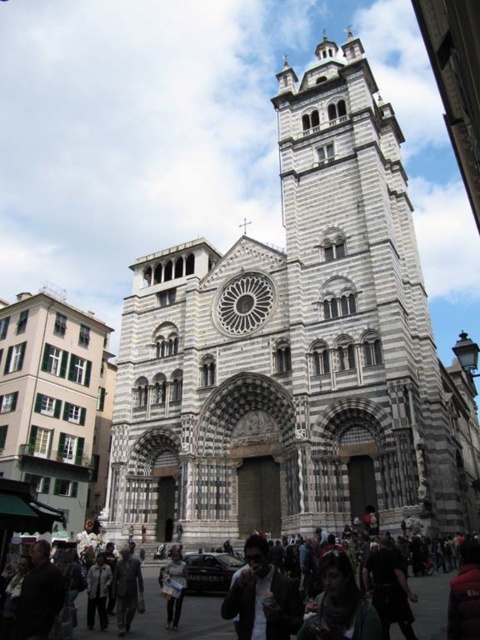
From the picture: You are standing in front of the cathedral and notice two points marked on the facade. The first point is at coordinate point (299, 113) and the second is at point (162, 580). Which point appears closer to you?

Point (162, 580) is closer to you because it is less further to the camera than point (299, 113).

You are standing in front of the cathedral and want to take a photo. You notice two points in the scene labeled as point 1 and point 2. If point 1 is at coordinate (466,576) and point 2 is at (184,577), which point is closer to your camera lens?

Point 1 at coordinate (466,576) is closer to the camera than point 2 at (184,577).